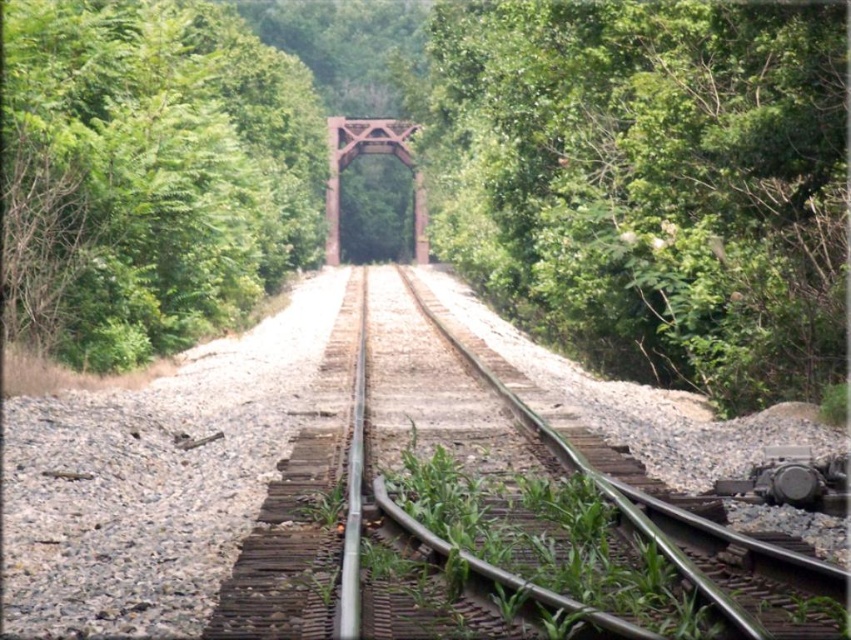
You are a maintenance worker needing to cross from the green leafy tree at left to the metallic train track at center. The gap between them is 34.51 feet. Do you think you can jump across? Please explain.

The gap between the green leafy tree at left and the metallic train track at center is 34.51 feet. Since the average human jump distance is around 10 feet, it is not possible to jump across this gap safely.

You are a maintenance worker who needs to check the height clearance for a new equipment truck that is 3 meters tall. You observe the metallic train track at center and the rusty metal train bridge at center. Which object has a lower height that could potentially block the truck?

The metallic train track at center is not as tall as the rusty metal train bridge at center, so the metallic train track at center has a lower height and may block the truck if it is under 3 meters.

You are a hiker who has just arrived at the railway tracks. You see the green leafy tree at center and the rusty metal train bridge at center. Which object is closer to you?

The green leafy tree at center is closer because it is in front of the rusty metal train bridge at center.